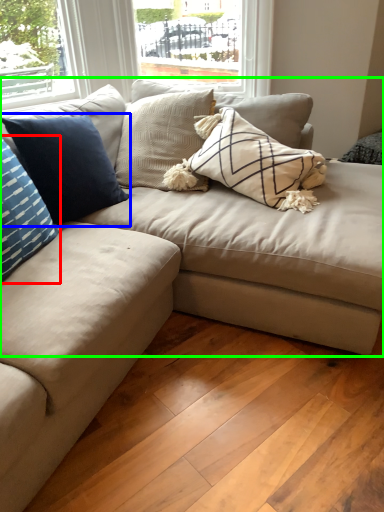
Question: Which object is positioned farthest from pillow (highlighted by a red box)? Select from pillow (highlighted by a blue box) and studio couch (highlighted by a green box).

Choices:
 (A) pillow
 (B) studio couch

Answer: (B)